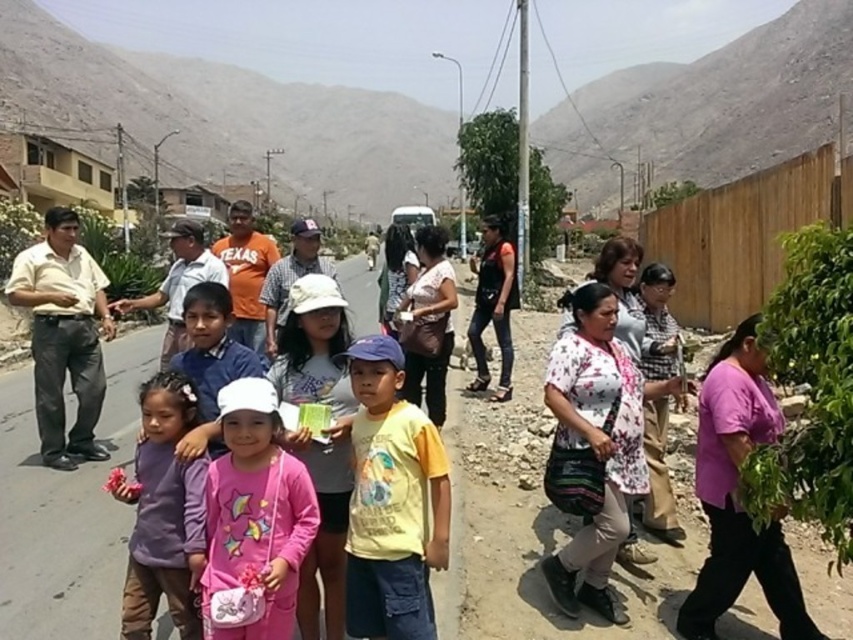
You are a photographer trying to capture a photo of the pink fabric purse at center and the purple fleece jacket at lower left. Which object should you focus on first if you want to ensure both are in the frame without moving the camera?

The pink fabric purse at center is above the purple fleece jacket at lower left, so you should focus on the purple fleece jacket at lower left first to ensure both are in the frame without moving the camera.

You are standing at the origin point in the image and want to locate the yellow cotton shirt at center. In which direction should you move relative to your current position?

The yellow cotton shirt at center is located at point 0.784 in the x direction and 0.461 in the y direction relative to the origin. Since the x coordinate is greater than 0.5, you should move to the right. The y coordinate is also greater than 0.5, so you should move upwards as well. Therefore, you should move diagonally to the upper right direction to locate the yellow cotton shirt at center.

You are a photographer trying to capture a clear shot of the pink fabric purse at center and the purple fleece jacket at lower left. Which object should you focus on first if you want to ensure both are in focus without adjusting your camera settings?

The pink fabric purse at center is in front of the purple fleece jacket at lower left. To keep both in focus, you should focus on the purple fleece jacket at lower left first, as it is farther away, ensuring the depth of field includes both objects.